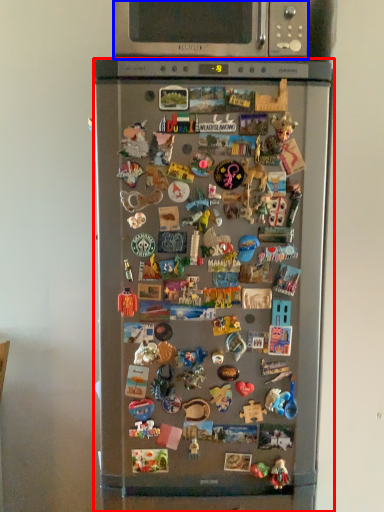
Question: Among these objects, which one is nearest to the camera, refrigerator (highlighted by a red box) or microwave oven (highlighted by a blue box)?

Choices:
 (A) refrigerator
 (B) microwave oven

Answer: (A)